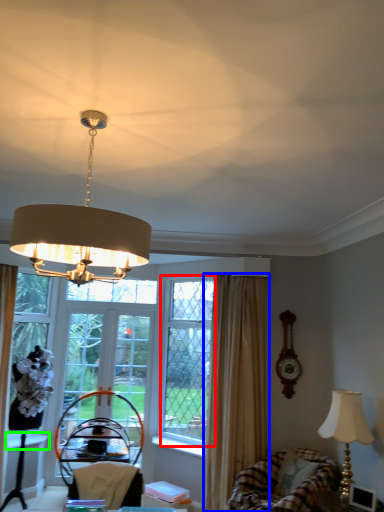
Question: Considering the real-world distances, which object is farthest from window screen (highlighted by a red box)? curtain (highlighted by a blue box) or window sill (highlighted by a green box)?

Choices:
 (A) curtain
 (B) window sill

Answer: (B)